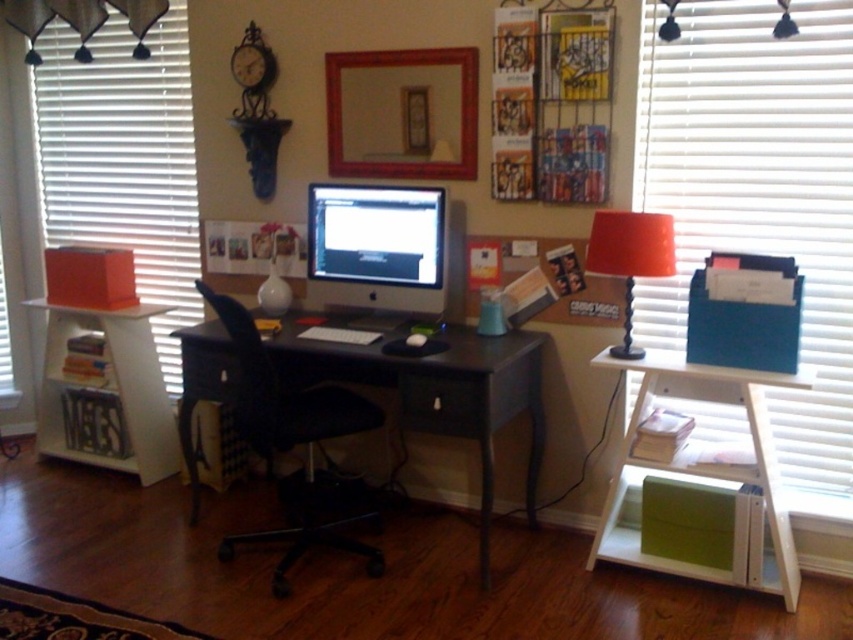
Question: Which point is farther from the camera taking this photo?

Choices:
 (A) (795, 403)
 (B) (439, 285)
 (C) (74, 328)
 (D) (630, 280)

Answer: (C)

Question: Does black wood desk at center have a lesser width compared to white wood bookshelf at lower left?

Choices:
 (A) no
 (B) yes

Answer: (A)

Question: Is black wood desk at center above black plastic swivel chair at center?

Choices:
 (A) yes
 (B) no

Answer: (A)

Question: Can you confirm if white blinds at right is positioned to the left of white blinds at left?

Choices:
 (A) yes
 (B) no

Answer: (B)

Question: Which point is closer to the camera taking this photo?

Choices:
 (A) (656, 250)
 (B) (225, 380)

Answer: (A)

Question: Which of these objects is positioned farthest from the white blinds at right?

Choices:
 (A) black plastic swivel chair at center
 (B) satin black monitor at center

Answer: (A)